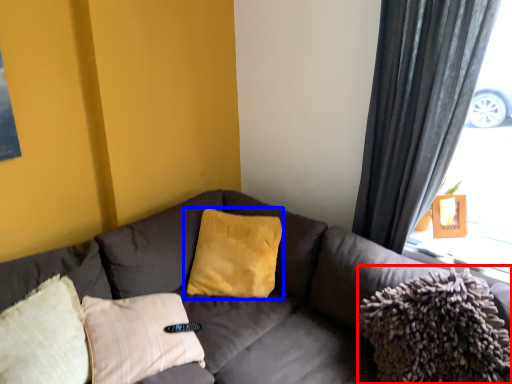
Question: Which object is closer to the camera taking this photo, material (highlighted by a red box) or pillow (highlighted by a blue box)?

Choices:
 (A) material
 (B) pillow

Answer: (A)